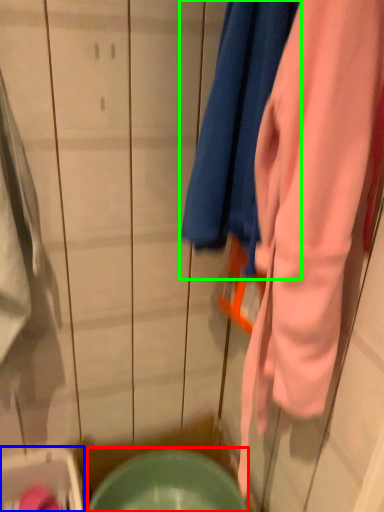
Question: Which object is positioned closest to mixing bowl (highlighted by a red box)? Select from washer (highlighted by a blue box) and towel (highlighted by a green box).

Choices:
 (A) washer
 (B) towel

Answer: (A)